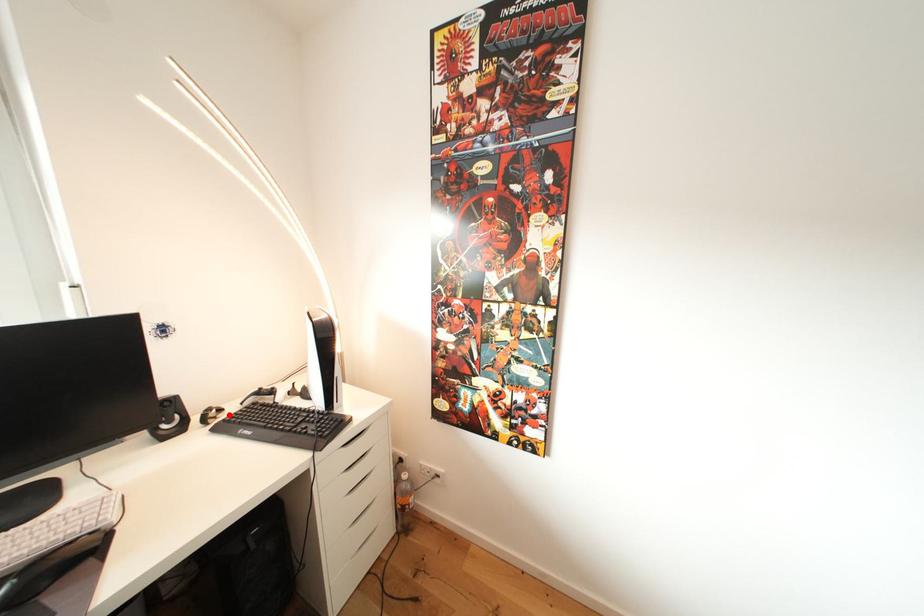
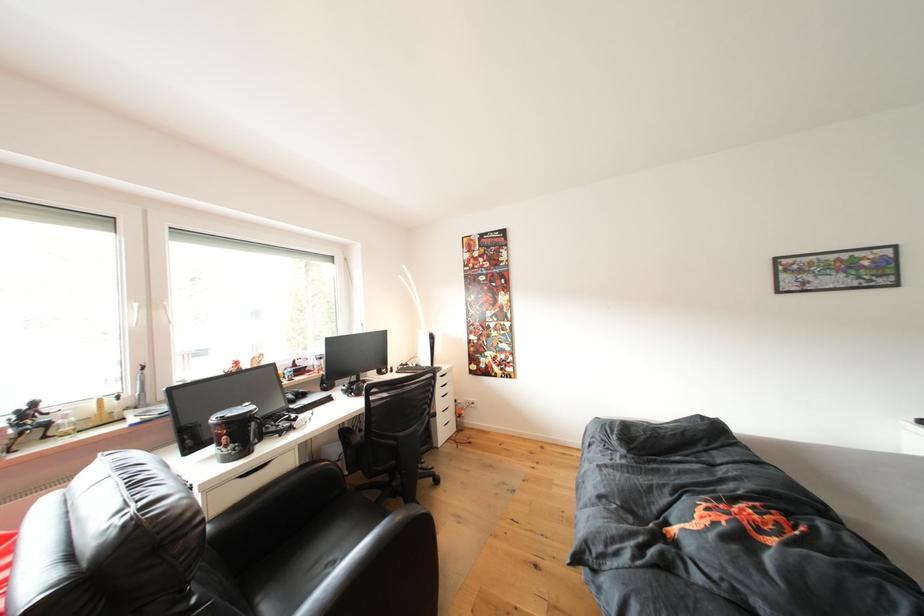
Question: I am providing you with two images of the same scene from different viewpoints. A red point is marked on the first image. Is the red point's position out of view in image 2?

Choices:
 (A) Yes
 (B) No

Answer: (A)